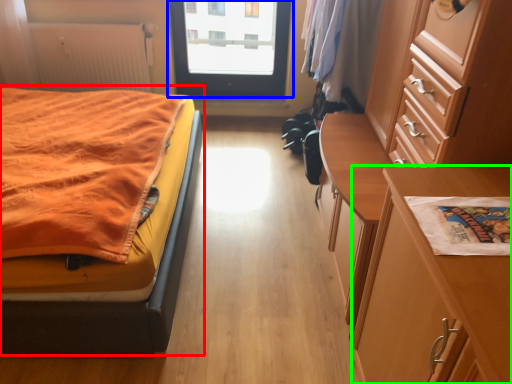
Question: Based on their relative distances, which object is nearer to bed (highlighted by a red box)? Choose from door (highlighted by a blue box) and table (highlighted by a green box).

Choices:
 (A) door
 (B) table

Answer: (B)